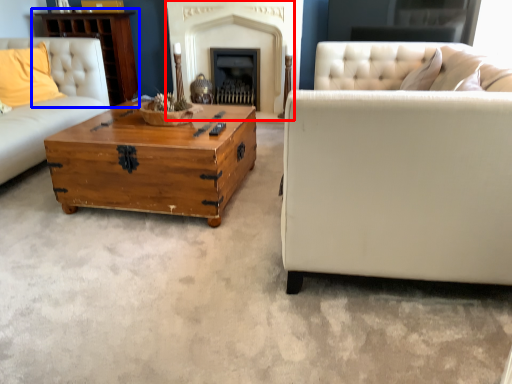
Question: Which object appears farthest to the camera in this image, fireplace (highlighted by a red box) or dresser (highlighted by a blue box)?

Choices:
 (A) fireplace
 (B) dresser

Answer: (B)